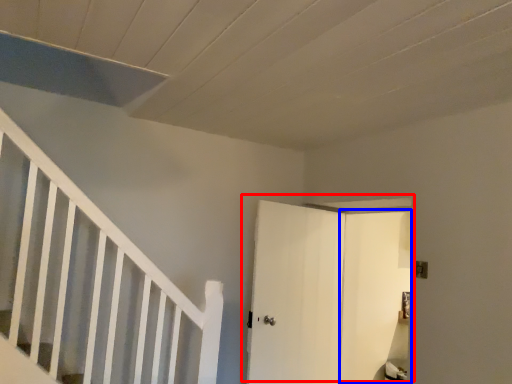
Question: Which of the following is the farthest to the observer, door (highlighted by a red box) or door (highlighted by a blue box)?

Choices:
 (A) door
 (B) door

Answer: (A)